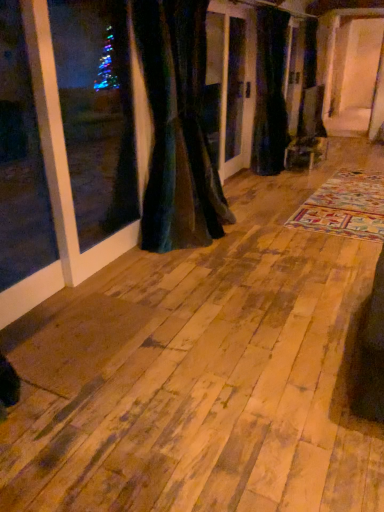
The image size is (384, 512). What are the coordinates of `velvet dark green curtain at center, the first curtain positioned from the front` in the screenshot? It's located at (178, 128).

Describe the element at coordinates (178, 128) in the screenshot. Image resolution: width=384 pixels, height=512 pixels. I see `velvet dark green curtain at center, arranged as the 2th curtain when viewed from the back` at that location.

Image resolution: width=384 pixels, height=512 pixels. What do you see at coordinates (270, 92) in the screenshot?
I see `velvet dark green curtain at center, the 1th curtain when ordered from right to left` at bounding box center [270, 92].

Where is `velvet dark green curtain at center, acting as the 1th curtain starting from the back`? velvet dark green curtain at center, acting as the 1th curtain starting from the back is located at coordinates (270, 92).

This screenshot has width=384, height=512. Find the location of `velvet dark green curtain at center, the first curtain positioned from the front`. velvet dark green curtain at center, the first curtain positioned from the front is located at coordinates (178, 128).

Does velvet dark green curtain at center, the 2th curtain from the left, appear on the left side of velvet dark green curtain at center, arranged as the 2th curtain when viewed from the back?

In fact, velvet dark green curtain at center, the 2th curtain from the left, is to the right of velvet dark green curtain at center, arranged as the 2th curtain when viewed from the back.

Consider the image. Considering their positions, is velvet dark green curtain at center, acting as the 1th curtain starting from the back, located in front of or behind velvet dark green curtain at center, the 1th curtain viewed from the left?

Clearly, velvet dark green curtain at center, acting as the 1th curtain starting from the back, is behind velvet dark green curtain at center, the 1th curtain viewed from the left.

Which is nearer, (258, 51) or (201, 39)?

The point (201, 39) is more forward.

From the image's perspective, between velvet dark green curtain at center, acting as the 1th curtain starting from the back, and velvet dark green curtain at center, the first curtain positioned from the front, who is located below?

velvet dark green curtain at center, the first curtain positioned from the front.

From a real-world perspective, between velvet dark green curtain at center, the 1th curtain when ordered from right to left, and velvet dark green curtain at center, the first curtain positioned from the front, who is vertically higher?

velvet dark green curtain at center, the 1th curtain when ordered from right to left.

Between velvet dark green curtain at center, which is the 2th curtain in front-to-back order, and velvet dark green curtain at center, arranged as the 2th curtain when viewed from the back, which one has smaller width?

Thinner between the two is velvet dark green curtain at center, which is the 2th curtain in front-to-back order.

Does velvet dark green curtain at center, the 1th curtain when ordered from right to left, have a greater height compared to velvet dark green curtain at center, arranged as the 2th curtain when viewed from the back?

Yes, velvet dark green curtain at center, the 1th curtain when ordered from right to left, is taller than velvet dark green curtain at center, arranged as the 2th curtain when viewed from the back.

Is velvet dark green curtain at center, the 2th curtain from the left, smaller than velvet dark green curtain at center, arranged as the 2th curtain when viewed from the back?

Yes.

Can we say velvet dark green curtain at center, acting as the 1th curtain starting from the back, lies outside velvet dark green curtain at center, which is the 2th curtain from right to left?

That's correct, velvet dark green curtain at center, acting as the 1th curtain starting from the back, is outside of velvet dark green curtain at center, which is the 2th curtain from right to left.

Is velvet dark green curtain at center, the 1th curtain when ordered from right to left, far from velvet dark green curtain at center, the 1th curtain viewed from the left?

Yes, velvet dark green curtain at center, the 1th curtain when ordered from right to left, and velvet dark green curtain at center, the 1th curtain viewed from the left, are quite far apart.

Is velvet dark green curtain at center, which is the 2th curtain in front-to-back order, turned away from velvet dark green curtain at center, which is the 2th curtain from right to left?

No, velvet dark green curtain at center, which is the 2th curtain in front-to-back order, is not facing away from velvet dark green curtain at center, which is the 2th curtain from right to left.

Can you tell me how much velvet dark green curtain at center, which is the 2th curtain in front-to-back order, and velvet dark green curtain at center, the first curtain positioned from the front, differ in facing direction?

0.000725 degrees.

How far apart are velvet dark green curtain at center, which is the 2th curtain in front-to-back order, and velvet dark green curtain at center, arranged as the 2th curtain when viewed from the back?

They are 5.96 feet apart.

Locate an element on the screen. The height and width of the screenshot is (512, 384). curtain on the right of velvet dark green curtain at center, the first curtain positioned from the front is located at coordinates (270, 92).

Does velvet dark green curtain at center, the first curtain positioned from the front, appear on the left side of velvet dark green curtain at center, the 1th curtain when ordered from right to left?

Indeed, velvet dark green curtain at center, the first curtain positioned from the front, is positioned on the left side of velvet dark green curtain at center, the 1th curtain when ordered from right to left.

Is the position of velvet dark green curtain at center, the first curtain positioned from the front, less distant than that of velvet dark green curtain at center, which is the 2th curtain in front-to-back order?

Yes, velvet dark green curtain at center, the first curtain positioned from the front, is in front of velvet dark green curtain at center, which is the 2th curtain in front-to-back order.

Is point (173, 18) closer or farther from the camera than point (258, 11)?

Point (173, 18) appears to be closer to the viewer than point (258, 11).

From the image's perspective, who appears lower, velvet dark green curtain at center, the first curtain positioned from the front, or velvet dark green curtain at center, the 1th curtain when ordered from right to left?

velvet dark green curtain at center, the first curtain positioned from the front, is shown below in the image.

Based on the photo, from a real-world perspective, relative to velvet dark green curtain at center, the 1th curtain when ordered from right to left, is velvet dark green curtain at center, the 1th curtain viewed from the left, vertically above or below?

In terms of real-world spatial position, velvet dark green curtain at center, the 1th curtain viewed from the left, is below velvet dark green curtain at center, the 1th curtain when ordered from right to left.

Considering the relative sizes of velvet dark green curtain at center, which is the 2th curtain from right to left, and velvet dark green curtain at center, acting as the 1th curtain starting from the back, in the image provided, is velvet dark green curtain at center, which is the 2th curtain from right to left, wider than velvet dark green curtain at center, acting as the 1th curtain starting from the back,?

Yes.

From their relative heights in the image, would you say velvet dark green curtain at center, the first curtain positioned from the front, is taller or shorter than velvet dark green curtain at center, the 1th curtain when ordered from right to left?

Clearly, velvet dark green curtain at center, the first curtain positioned from the front, is shorter compared to velvet dark green curtain at center, the 1th curtain when ordered from right to left.

Considering the sizes of objects velvet dark green curtain at center, the 1th curtain viewed from the left, and velvet dark green curtain at center, the 1th curtain when ordered from right to left, in the image provided, who is smaller, velvet dark green curtain at center, the 1th curtain viewed from the left, or velvet dark green curtain at center, the 1th curtain when ordered from right to left,?

With smaller size is velvet dark green curtain at center, the 1th curtain when ordered from right to left.

Which is correct: velvet dark green curtain at center, the first curtain positioned from the front, is inside velvet dark green curtain at center, the 1th curtain when ordered from right to left, or outside of it?

velvet dark green curtain at center, the first curtain positioned from the front, exists outside the volume of velvet dark green curtain at center, the 1th curtain when ordered from right to left.

Are velvet dark green curtain at center, the 1th curtain viewed from the left, and velvet dark green curtain at center, acting as the 1th curtain starting from the back, located far from each other?

Yes, velvet dark green curtain at center, the 1th curtain viewed from the left, and velvet dark green curtain at center, acting as the 1th curtain starting from the back, are located far from each other.

Is velvet dark green curtain at center, the first curtain positioned from the front, looking in the opposite direction of velvet dark green curtain at center, acting as the 1th curtain starting from the back?

That's not correct — velvet dark green curtain at center, the first curtain positioned from the front, is not looking away from velvet dark green curtain at center, acting as the 1th curtain starting from the back.

How different are the orientations of velvet dark green curtain at center, which is the 2th curtain from right to left, and velvet dark green curtain at center, the 2th curtain from the left, in degrees?

The angle between the facing direction of velvet dark green curtain at center, which is the 2th curtain from right to left, and the facing direction of velvet dark green curtain at center, the 2th curtain from the left, is 0.000725 degrees.

There is a velvet dark green curtain at center, the 1th curtain viewed from the left. Identify the location of curtain above it (from a real-world perspective). (270, 92).

Find the location of a particular element. curtain on the left of velvet dark green curtain at center, the 1th curtain when ordered from right to left is located at coordinates tap(178, 128).

This screenshot has width=384, height=512. Identify the location of curtain located underneath the velvet dark green curtain at center, acting as the 1th curtain starting from the back (from a real-world perspective). (178, 128).